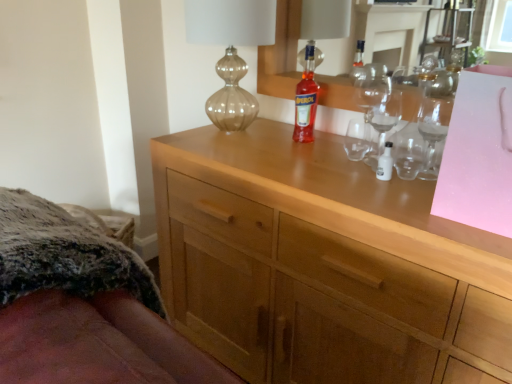
Question: From a real-world perspective, is fuzzy fabric bed at lower left on top of translucent glass bottle at center?

Choices:
 (A) yes
 (B) no

Answer: (B)

Question: Are fuzzy fabric bed at lower left and translucent glass bottle at center making contact?

Choices:
 (A) no
 (B) yes

Answer: (A)

Question: Does fuzzy fabric bed at lower left come behind translucent glass bottle at center?

Choices:
 (A) no
 (B) yes

Answer: (A)

Question: Is fuzzy fabric bed at lower left bigger than translucent glass bottle at center?

Choices:
 (A) yes
 (B) no

Answer: (A)

Question: Could you tell me if fuzzy fabric bed at lower left is facing translucent glass bottle at center?

Choices:
 (A) yes
 (B) no

Answer: (B)

Question: Is transparent glass wine glass at upper right inside the boundaries of light wood cabinet at center, or outside?

Choices:
 (A) inside
 (B) outside

Answer: (B)

Question: From their relative heights in the image, would you say transparent glass wine glass at upper right is taller or shorter than light wood cabinet at center?

Choices:
 (A) short
 (B) tall

Answer: (A)

Question: Considering the positions of transparent glass wine glass at upper right and light wood cabinet at center in the image, is transparent glass wine glass at upper right bigger or smaller than light wood cabinet at center?

Choices:
 (A) small
 (B) big

Answer: (A)

Question: From the image's perspective, is transparent glass wine glass at upper right positioned above or below light wood cabinet at center?

Choices:
 (A) above
 (B) below

Answer: (A)

Question: Relative to transparent glass wine glass at upper right, is translucent glass vase at upper center in front or behind?

Choices:
 (A) front
 (B) behind

Answer: (B)

Question: Is translucent glass vase at upper center inside the boundaries of transparent glass wine glass at upper right, or outside?

Choices:
 (A) inside
 (B) outside

Answer: (B)

Question: From a real-world perspective, relative to transparent glass wine glass at upper right, is translucent glass vase at upper center vertically above or below?

Choices:
 (A) above
 (B) below

Answer: (A)

Question: Considering the positions of translucent glass vase at upper center and transparent glass wine glass at upper right in the image, is translucent glass vase at upper center wider or thinner than transparent glass wine glass at upper right?

Choices:
 (A) wide
 (B) thin

Answer: (A)

Question: Considering the positions of point (133, 264) and point (313, 67), is point (133, 264) closer or farther from the camera than point (313, 67)?

Choices:
 (A) closer
 (B) farther

Answer: (A)

Question: Relative to translucent glass bottle at center, is fuzzy fabric bed at lower left in front or behind?

Choices:
 (A) behind
 (B) front

Answer: (B)